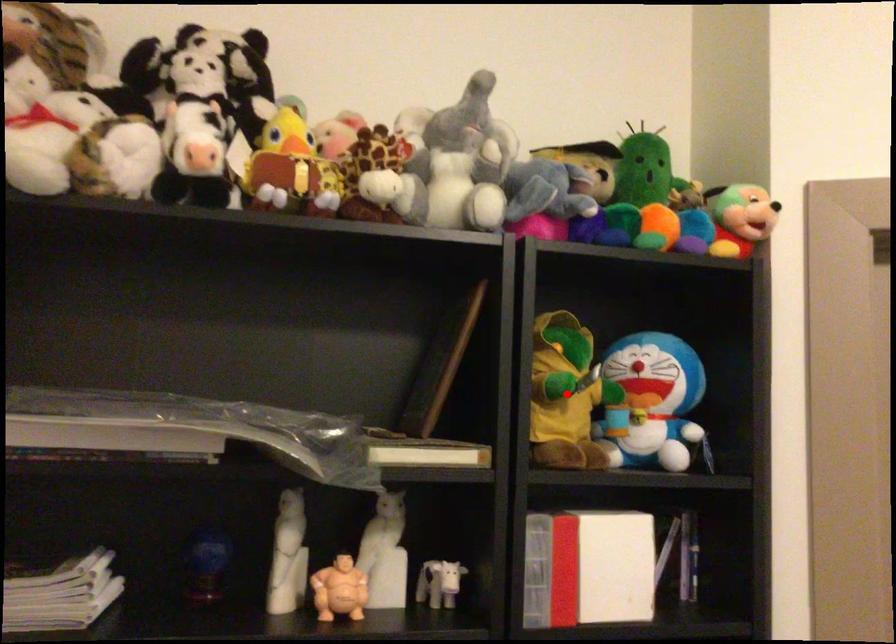
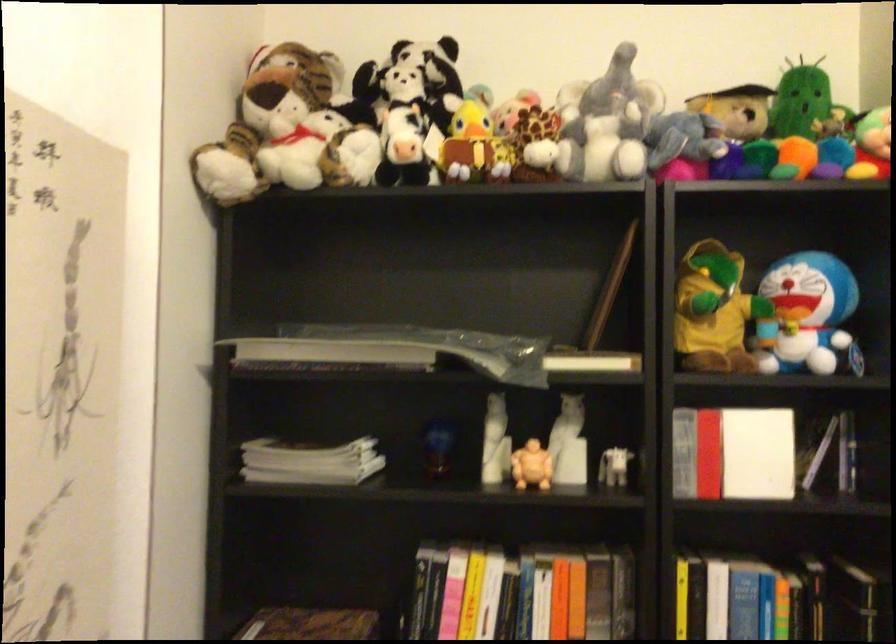
Find the pixel in the second image that matches the highlighted location in the first image.

(713, 310)